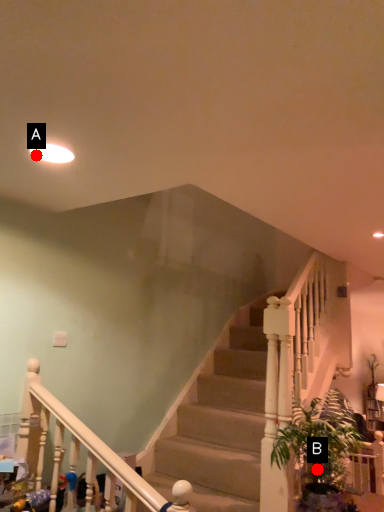
Question: Two points are circled on the image, labeled by A and B beside each circle. Which point is closer to the camera taking this photo?

Choices:
 (A) A is closer
 (B) B is closer

Answer: (A)